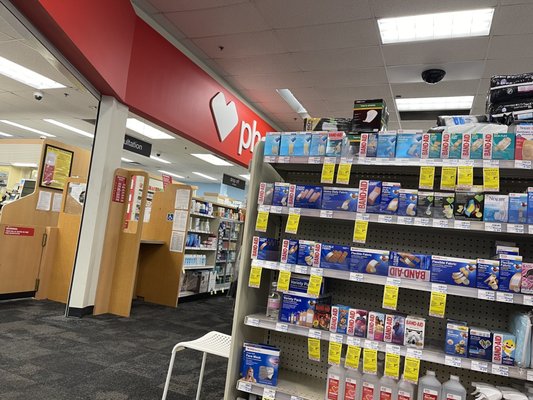
The image size is (533, 400). What are the coordinates of `white drop ceiling` in the screenshot? It's located at coord(349,79).